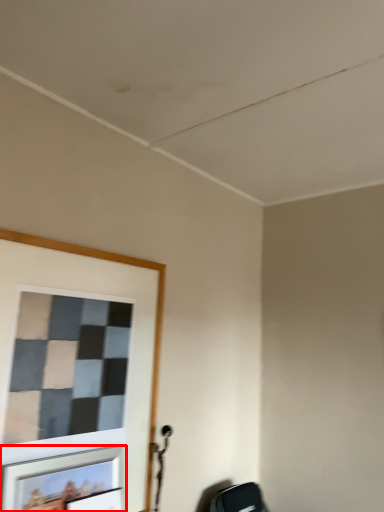
Question: From the image's perspective, where is picture frame (annotated by the red box) located relative to picture frame?

Choices:
 (A) below
 (B) above

Answer: (B)